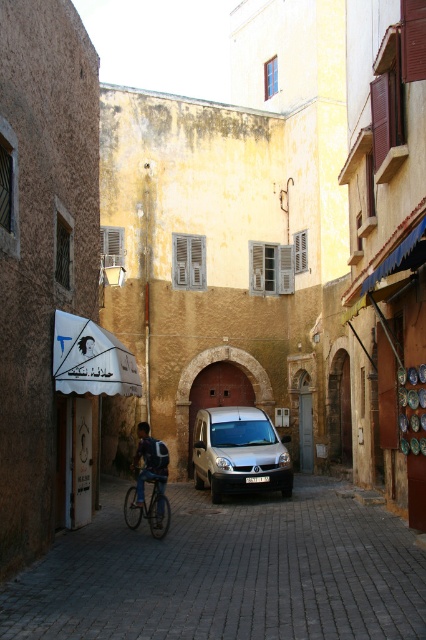
In the scene shown: Who is higher up, blue denim jacket at center or shiny metallic bicycle at center?

blue denim jacket at center is higher up.

Can you confirm if blue denim jacket at center is bigger than shiny metallic bicycle at center?

Yes, blue denim jacket at center is bigger than shiny metallic bicycle at center.

Who is more distant from viewer, [146,448] or [164,483]?

The point [146,448] is behind.

This screenshot has height=640, width=426. I want to click on blue denim jacket at center, so click(149, 461).

Which of these two, gray cobblestone alley at center or silver metallic van at center, stands shorter?

gray cobblestone alley at center

Does point (394, 630) lie in front of point (287, 497)?

Yes, it is.

What do you see at coordinates (227, 572) in the screenshot? This screenshot has height=640, width=426. I see `gray cobblestone alley at center` at bounding box center [227, 572].

You are a GUI agent. You are given a task and a screenshot of the screen. Output one action in this format:
    pyautogui.click(x=<x>, y=<y>)
    Task: Click on the gray cobblestone alley at center
    The width and height of the screenshot is (426, 640).
    Given the screenshot: What is the action you would take?
    pyautogui.click(x=227, y=572)

Between white fabric canopy at left and blue denim jacket at center, which one appears on the left side from the viewer's perspective?

white fabric canopy at left is more to the left.

Does white fabric canopy at left have a larger size compared to blue denim jacket at center?

No.

Is point (74, 356) in front of point (154, 452)?

Yes, it is.

This screenshot has height=640, width=426. I want to click on white fabric canopy at left, so click(91, 358).